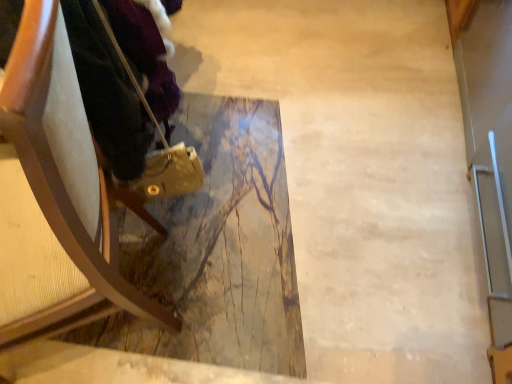
Measure the distance between point (50, 241) and camera.

Point (50, 241) is 33.50 inches away from camera.

What is the approximate height of brown leather chair at lower left?

brown leather chair at lower left is 38.90 inches in height.

Describe the element at coordinates (54, 197) in the screenshot. The image size is (512, 384). I see `brown leather chair at lower left` at that location.

This screenshot has width=512, height=384. Find the location of `brown leather chair at lower left`. brown leather chair at lower left is located at coordinates (54, 197).

Locate an element on the screen. This screenshot has height=384, width=512. brown leather chair at lower left is located at coordinates click(54, 197).